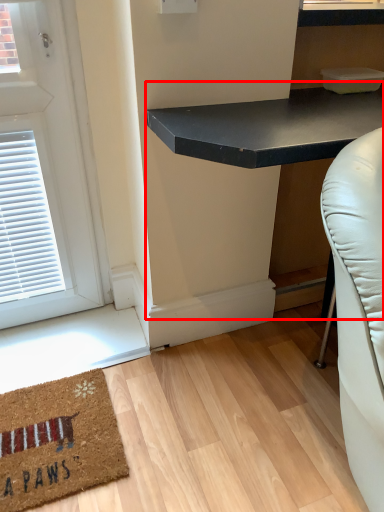
Question: In this image, where is table (annotated by the red box) located relative to mat?

Choices:
 (A) right
 (B) left

Answer: (A)